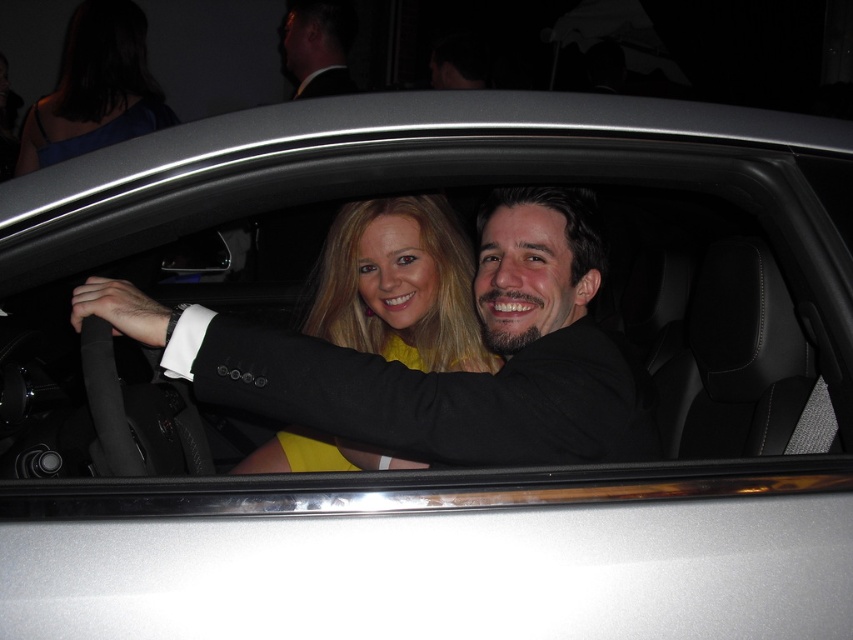
You are a photographer at a car event. You want to take a closeup shot of the yellow matte dress at center. Your camera has a minimum focusing distance of 5 feet. Can you take the photo without moving closer?

The yellow matte dress at center is 4.81 feet away from camera. Since the minimum focusing distance is 5 feet, the camera cannot focus at that distance. You need to move back to ensure the subject is at least 5 feet away.

You are standing in front of the car and want to locate the blue satin dress at upper left. According to the coordinates provided, where exactly should you look on the car?

The blue satin dress at upper left is located at coordinates point (96, 88) on the car.